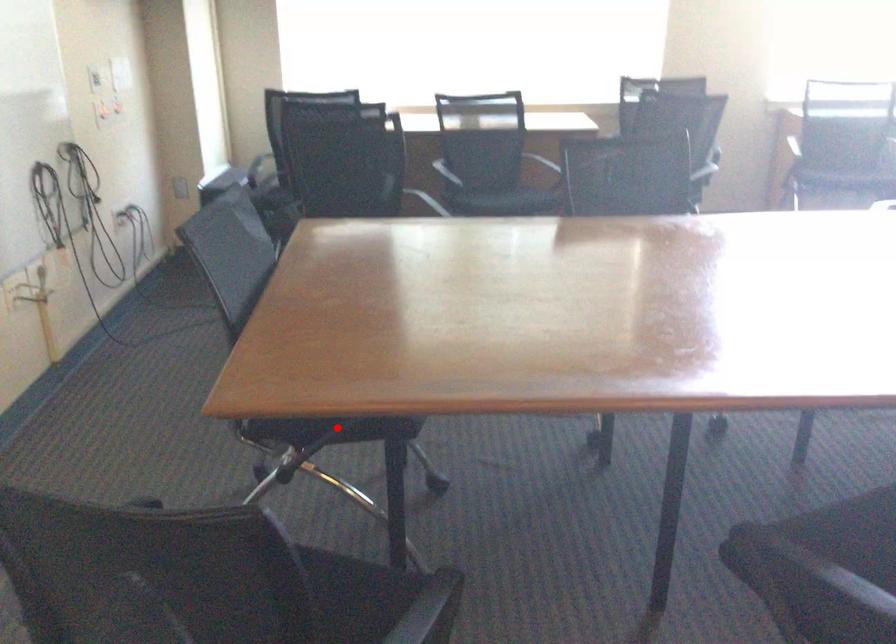
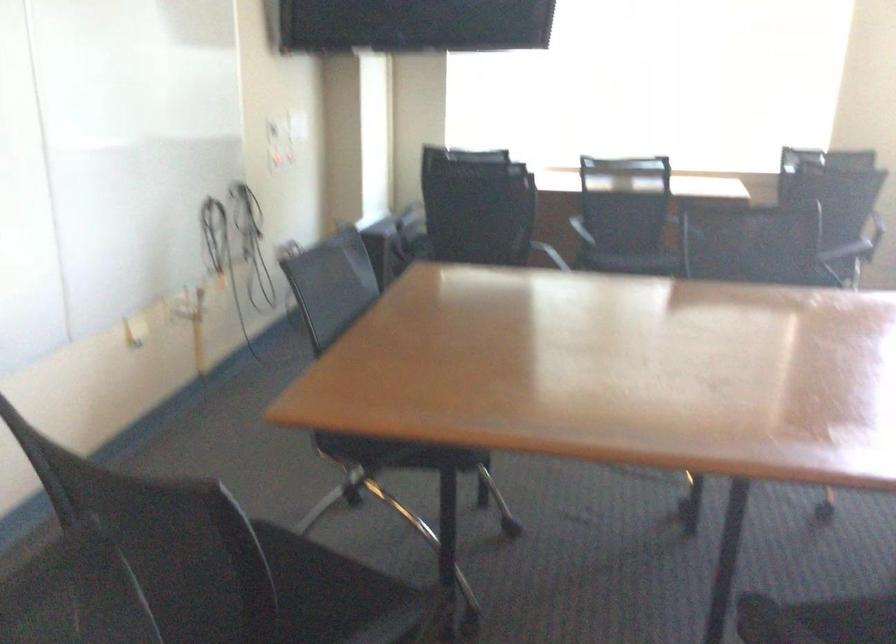
The point at the highlighted location is marked in the first image. Where is the corresponding point in the second image?

(400, 453)